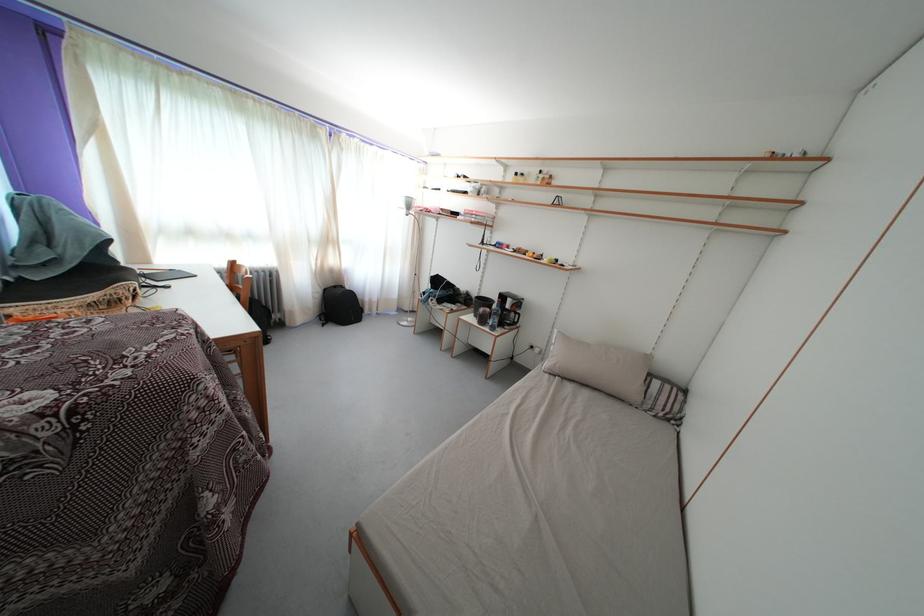
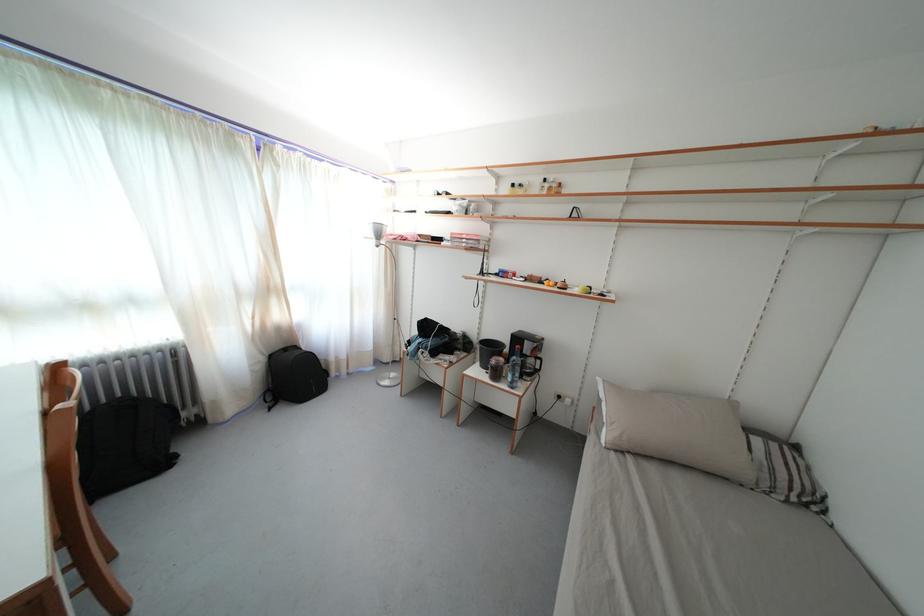
Find the pixel in the second image that matches (487,315) in the first image.

(499, 367)